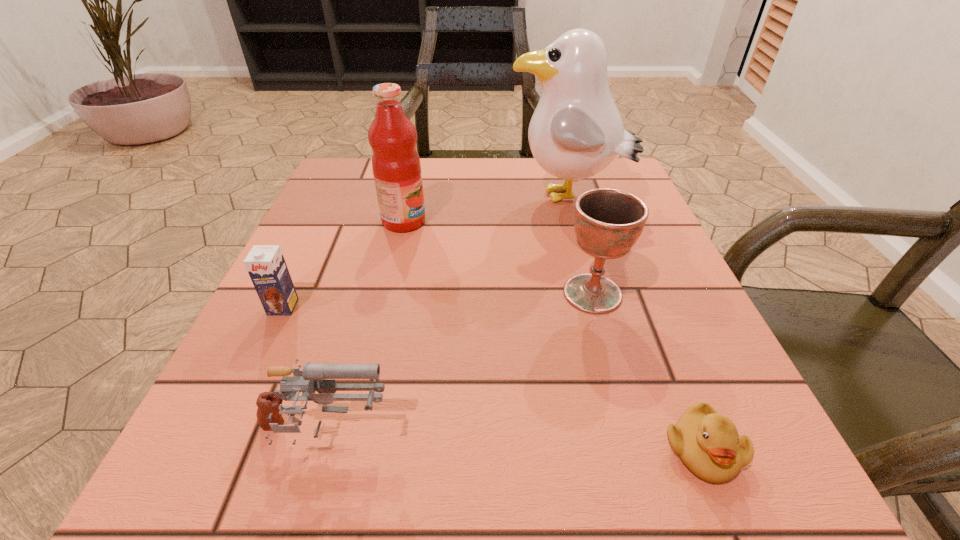
What are the coordinates of `gull that is at the right edge` in the screenshot? It's located at (576, 131).

The width and height of the screenshot is (960, 540). I want to click on chalice present at the right edge, so click(608, 222).

I want to click on duckling that is at the right edge, so click(x=708, y=443).

Find the location of `object that is at the far left corner`. object that is at the far left corner is located at coordinates (396, 166).

Find the location of a particular element. Image resolution: width=960 pixels, height=540 pixels. object that is at the near left corner is located at coordinates (269, 413).

Where is `object that is positioned at the far right corner`? The image size is (960, 540). object that is positioned at the far right corner is located at coordinates click(x=576, y=131).

Find the location of a particular element. This screenshot has height=540, width=960. object positioned at the near right corner is located at coordinates (708, 443).

At what (x,y) coordinates should I click in order to perform the action: click on vacant space at the far edge of the desktop. Please return your answer as a coordinate pair (x, y). Looking at the image, I should click on (488, 171).

Find the location of a particular element. The width and height of the screenshot is (960, 540). free region at the near edge of the desktop is located at coordinates (338, 478).

In the image, there is a desktop. Where is `vacant space at the left edge`? vacant space at the left edge is located at coordinates (245, 427).